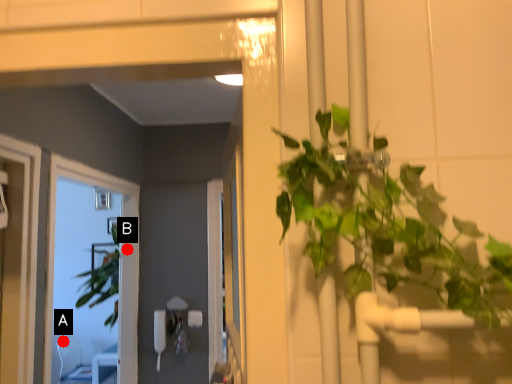
Question: Two points are circled on the image, labeled by A and B beside each circle. Which point is closer to the camera taking this photo?

Choices:
 (A) A is closer
 (B) B is closer

Answer: (B)